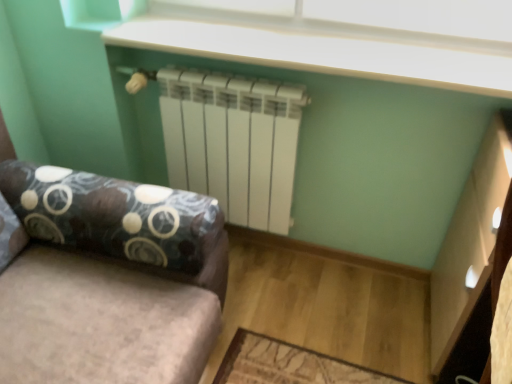
Question: Does point (501, 28) appear closer or farther from the camera than point (261, 134)?

Choices:
 (A) farther
 (B) closer

Answer: (B)

Question: From a real-world perspective, is white plastic window screen at upper center positioned above or below white matte radiator at center?

Choices:
 (A) above
 (B) below

Answer: (A)

Question: Considering the real-world distances, which object is closest to the velvet fabric studio couch at center?

Choices:
 (A) white matte radiator at center
 (B) white plastic window screen at upper center

Answer: (A)

Question: Considering the real-world distances, which object is farthest from the velvet fabric studio couch at center?

Choices:
 (A) white plastic window screen at upper center
 (B) white matte radiator at center

Answer: (A)